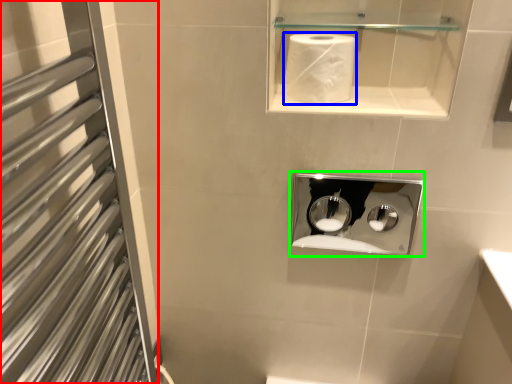
Question: Which object is positioned closest to screen door (highlighted by a red box)? Select from paper towel (highlighted by a blue box) and medicine cabinet (highlighted by a green box).

Choices:
 (A) paper towel
 (B) medicine cabinet

Answer: (A)